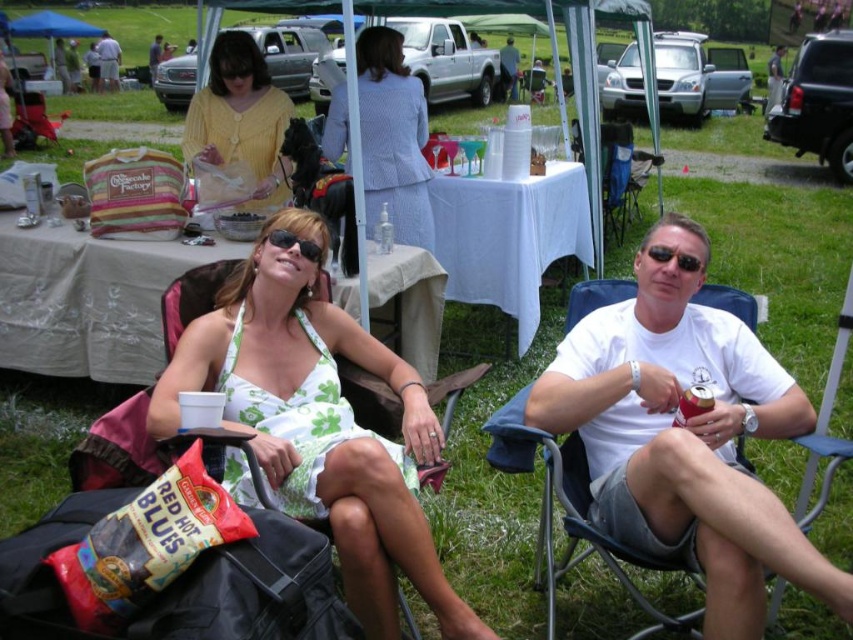
Question: Is light blue textured suit at center to the right of matte black jacket at upper left from the viewer's perspective?

Choices:
 (A) yes
 (B) no

Answer: (A)

Question: Does yellow knit sweater at upper left have a lesser width compared to light blue textured suit at center?

Choices:
 (A) no
 (B) yes

Answer: (A)

Question: Estimate the real-world distances between objects in this image. Which object is closer to the white floral dress at center?

Choices:
 (A) yellow knit sweater at upper left
 (B) light blue textured suit at center

Answer: (B)

Question: Among these points, which one is nearest to the camera?

Choices:
 (A) (273, 280)
 (B) (509, 92)
 (C) (112, 52)
 (D) (643, 328)

Answer: (D)

Question: Does white floral dress at center come in front of yellow knit sweater at upper left?

Choices:
 (A) no
 (B) yes

Answer: (B)

Question: Considering the real-world distances, which object is closest to the matte white shirt at center?

Choices:
 (A) white floral dress at center
 (B) white cotton t-shirt at center
 (C) light blue textured suit at center
 (D) green floral bikini top at center

Answer: (C)